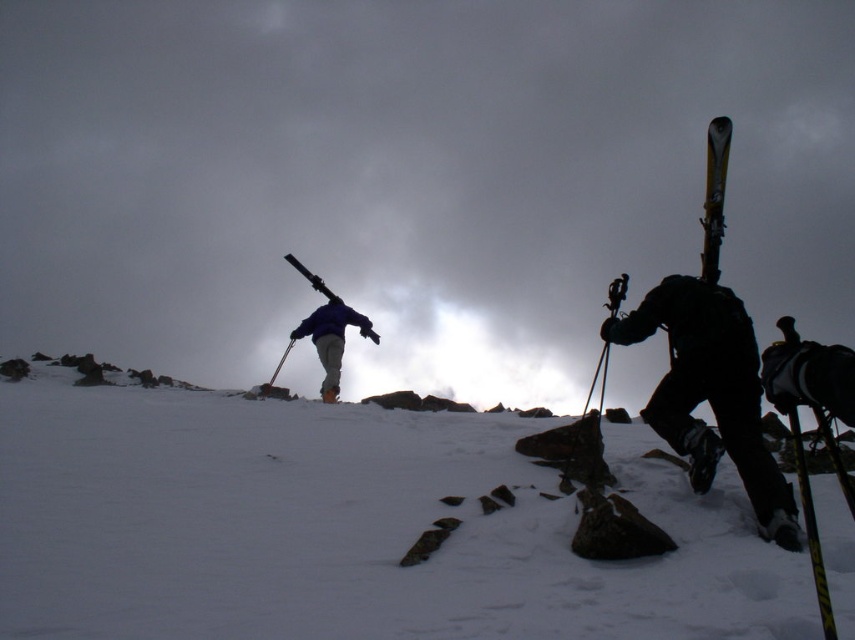
Question: Which object appears closest to the camera in this image?

Choices:
 (A) black matte ski at right
 (B) glossy metallic ski at upper right

Answer: (A)

Question: Is black matte ski at right positioned in front of glossy metallic ski at upper right?

Choices:
 (A) no
 (B) yes

Answer: (B)

Question: Which object appears closest to the camera in this image?

Choices:
 (A) blue fabric jacket at center
 (B) black matte ski at right
 (C) white powdery snow at center
 (D) glossy metallic ski at upper right

Answer: (C)

Question: Among these points, which one is farthest from the camera?

Choices:
 (A) (688, 467)
 (B) (708, 272)
 (C) (331, 369)
 (D) (540, 486)

Answer: (C)

Question: Is black matte ski at right bigger than glossy metallic ski at upper right?

Choices:
 (A) yes
 (B) no

Answer: (B)

Question: Does glossy metallic ski at upper right have a smaller size compared to blue fabric jacket at center?

Choices:
 (A) yes
 (B) no

Answer: (B)